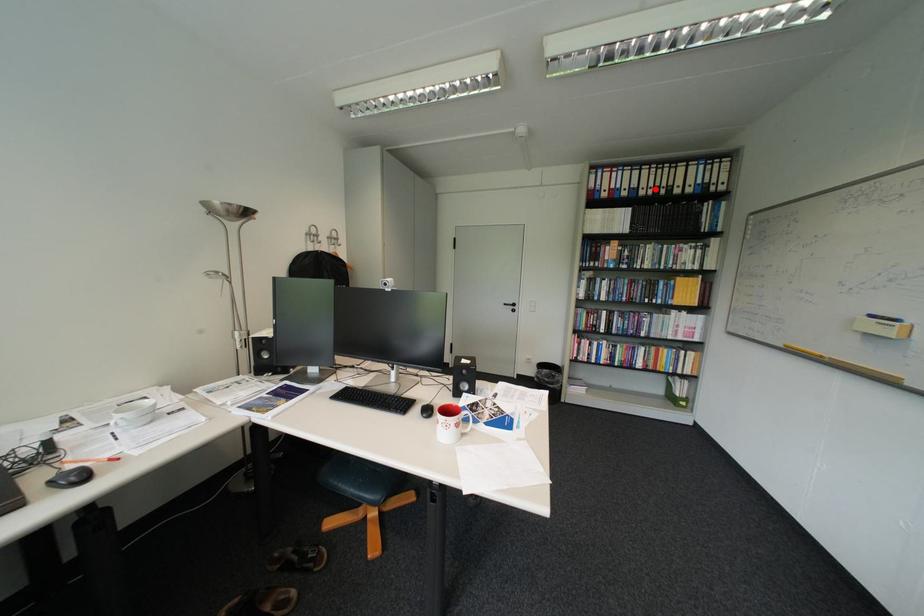
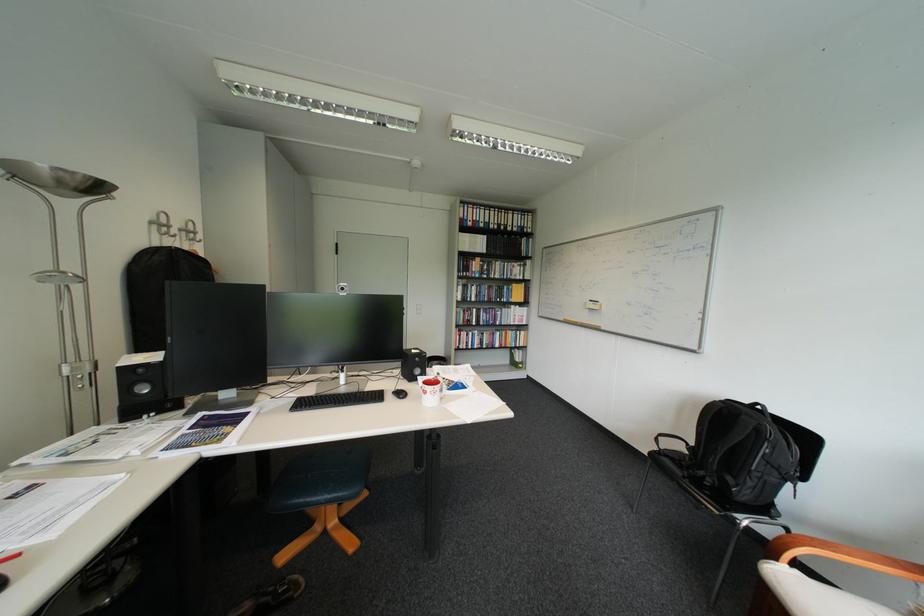
Find the pixel in the second image that matches the highlighted location in the first image.

(504, 224)